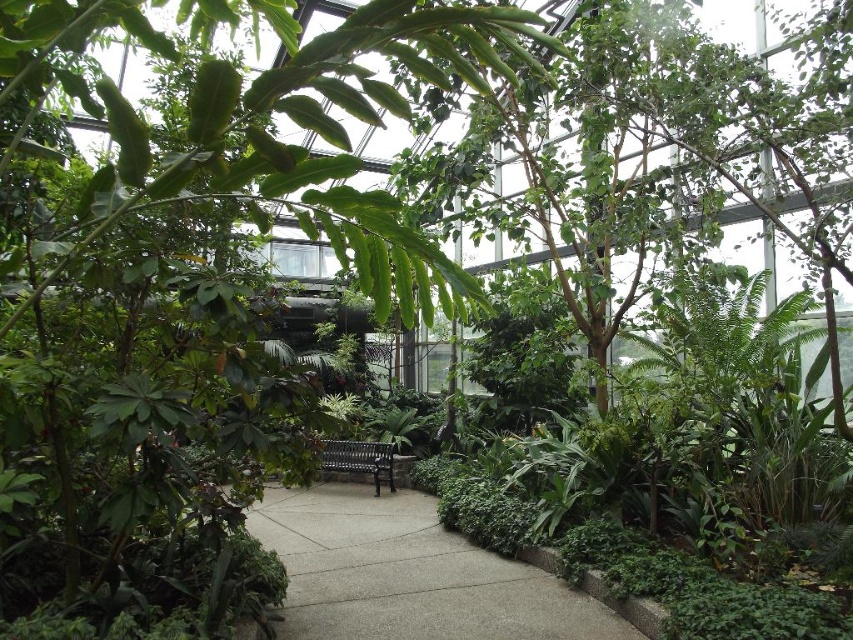
Question: Considering the relative positions of green leafy tree at center and black metal bench at center in the image provided, where is green leafy tree at center located with respect to black metal bench at center?

Choices:
 (A) right
 (B) left

Answer: (B)

Question: Which object is closer to the camera taking this photo?

Choices:
 (A) green leafy tree at center
 (B) black metal bench at center
 (C) concrete at center

Answer: (A)

Question: Which object is farther from the camera taking this photo?

Choices:
 (A) concrete at center
 (B) green leafy tree at center
 (C) black metal bench at center

Answer: (C)

Question: Does green leafy tree at center have a greater width compared to concrete at center?

Choices:
 (A) no
 (B) yes

Answer: (B)

Question: Is the position of green leafy tree at center more distant than that of black metal bench at center?

Choices:
 (A) yes
 (B) no

Answer: (B)

Question: Which object is positioned farthest from the black metal bench at center?

Choices:
 (A) concrete at center
 (B) green leafy tree at center

Answer: (B)